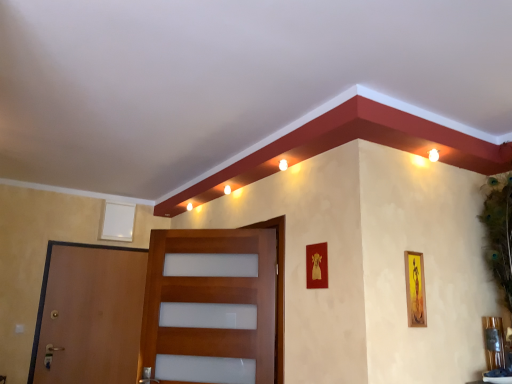
What do you see at coordinates (117, 222) in the screenshot?
I see `white matte picture frame at upper left, the first picture frame in the left-to-right sequence` at bounding box center [117, 222].

In order to click on yellow matte picture frame at right, which is the 1th picture frame from front to back in this screenshot , I will do `click(415, 289)`.

Find the location of `white matte picture frame at upper left, the first picture frame positioned from the back`. white matte picture frame at upper left, the first picture frame positioned from the back is located at coordinates [117, 222].

Consider the image. Could you tell me if white matte picture frame at upper left, the first picture frame in the left-to-right sequence, is turned towards wooden door at center, which is the first door in front-to-back order?

Yes, white matte picture frame at upper left, the first picture frame in the left-to-right sequence, is aimed at wooden door at center, which is the first door in front-to-back order.

Can you confirm if white matte picture frame at upper left, the first picture frame positioned from the back, is taller than wooden door at center, which is the first door in front-to-back order?

In fact, white matte picture frame at upper left, the first picture frame positioned from the back, may be shorter than wooden door at center, which is the first door in front-to-back order.

Is point (110, 229) positioned in front of point (273, 347)?

That is False.

From the image's perspective, is white matte picture frame at upper left, arranged as the third picture frame when viewed from the right, positioned above or below wooden door at center, which appears as the first door when viewed from the right?

white matte picture frame at upper left, arranged as the third picture frame when viewed from the right, is situated higher than wooden door at center, which appears as the first door when viewed from the right, in the image.

Which is further, (x=407, y=273) or (x=54, y=327)?

The point (x=54, y=327) is behind.

From a real-world perspective, who is located lower, yellow matte picture frame at right, the third picture frame when ordered from back to front, or brown wooden door at left, positioned as the second door in right-to-left order?

In real-world perspective, brown wooden door at left, positioned as the second door in right-to-left order, is lower.

Is yellow matte picture frame at right, placed as the third picture frame when sorted from left to right, at the left side of brown wooden door at left, which is counted as the first door, starting from the back?

Incorrect, yellow matte picture frame at right, placed as the third picture frame when sorted from left to right, is not on the left side of brown wooden door at left, which is counted as the first door, starting from the back.

Consider the image. From the image's perspective, which object appears higher, brown wooden door at left, which is counted as the first door, starting from the back, or yellow matte picture frame at right, which is the 1th picture frame from front to back?

yellow matte picture frame at right, which is the 1th picture frame from front to back.

Is brown wooden door at left, arranged as the first door when viewed from the left, wider or thinner than yellow matte picture frame at right, placed as the third picture frame when sorted from left to right?

In the image, brown wooden door at left, arranged as the first door when viewed from the left, appears to be wider than yellow matte picture frame at right, placed as the third picture frame when sorted from left to right.

From a real-world perspective, who is located higher, brown wooden door at left, which is the 2th door in front-to-back order, or yellow matte picture frame at right, which is counted as the first picture frame, starting from the right?

yellow matte picture frame at right, which is counted as the first picture frame, starting from the right.

Is point (72, 245) positioned in front of point (417, 324)?

No.

Can you see gold metallic picture frame at center, the second picture frame from the left, touching wooden door at center, which is the first door in front-to-back order?

No, gold metallic picture frame at center, the second picture frame from the left, is not making contact with wooden door at center, which is the first door in front-to-back order.

How distant is gold metallic picture frame at center, the second picture frame from the left, from wooden door at center, which is the first door in front-to-back order?

gold metallic picture frame at center, the second picture frame from the left, is 66.56 centimeters away from wooden door at center, which is the first door in front-to-back order.

How many degrees apart are the facing directions of gold metallic picture frame at center, which appears as the second picture frame when viewed from the right, and wooden door at center, which appears as the first door when viewed from the right?

64.3 degrees separate the facing orientations of gold metallic picture frame at center, which appears as the second picture frame when viewed from the right, and wooden door at center, which appears as the first door when viewed from the right.

Is gold metallic picture frame at center, the second picture frame in the back-to-front sequence, inside or outside of wooden door at center, positioned as the 2th door in left-to-right order?

gold metallic picture frame at center, the second picture frame in the back-to-front sequence, is not enclosed by wooden door at center, positioned as the 2th door in left-to-right order.

From the image's perspective, which is above, brown wooden door at left, arranged as the first door when viewed from the left, or white matte picture frame at upper left, the first picture frame positioned from the back?

white matte picture frame at upper left, the first picture frame positioned from the back, from the image's perspective.

Is brown wooden door at left, which is the 2th door in front-to-back order, not close to white matte picture frame at upper left, the first picture frame positioned from the back?

No, brown wooden door at left, which is the 2th door in front-to-back order, is not far from white matte picture frame at upper left, the first picture frame positioned from the back.

What's the angular difference between brown wooden door at left, arranged as the first door when viewed from the left, and white matte picture frame at upper left, the first picture frame in the left-to-right sequence,'s facing directions?

The facing directions of brown wooden door at left, arranged as the first door when viewed from the left, and white matte picture frame at upper left, the first picture frame in the left-to-right sequence, are 0.312 degrees apart.

Locate an element on the screen. This screenshot has width=512, height=384. the 1st door in front when counting from the white matte picture frame at upper left, the first picture frame in the left-to-right sequence is located at coordinates (90, 314).

At what (x,y) coordinates should I click in order to perform the action: click on the 2nd picture frame below the white matte picture frame at upper left, arranged as the third picture frame when viewed from the front (from the image's perspective). Please return your answer as a coordinate pair (x, y). Image resolution: width=512 pixels, height=384 pixels. Looking at the image, I should click on (415, 289).

Would you consider yellow matte picture frame at right, which is the 1th picture frame from front to back, to be distant from white matte picture frame at upper left, arranged as the third picture frame when viewed from the right?

Indeed, yellow matte picture frame at right, which is the 1th picture frame from front to back, is not near white matte picture frame at upper left, arranged as the third picture frame when viewed from the right.

Considering the sizes of objects yellow matte picture frame at right, the third picture frame when ordered from back to front, and white matte picture frame at upper left, the first picture frame in the left-to-right sequence, in the image provided, who is taller, yellow matte picture frame at right, the third picture frame when ordered from back to front, or white matte picture frame at upper left, the first picture frame in the left-to-right sequence,?

Standing taller between the two is yellow matte picture frame at right, the third picture frame when ordered from back to front.

From the image's perspective, is yellow matte picture frame at right, the third picture frame when ordered from back to front, located above or below white matte picture frame at upper left, the first picture frame in the left-to-right sequence?

Clearly, from the image's perspective, yellow matte picture frame at right, the third picture frame when ordered from back to front, is below white matte picture frame at upper left, the first picture frame in the left-to-right sequence.

From the image's perspective, which object appears higher, wooden door at center, positioned as the 2th door in left-to-right order, or gold metallic picture frame at center, the second picture frame from the left?

gold metallic picture frame at center, the second picture frame from the left, appears higher in the image.

In the scene shown: What's the angular difference between wooden door at center, which appears as the first door when viewed from the right, and gold metallic picture frame at center, the second picture frame in the back-to-front sequence,'s facing directions?

There is a 64.3-degree angle between the facing directions of wooden door at center, which appears as the first door when viewed from the right, and gold metallic picture frame at center, the second picture frame in the back-to-front sequence.

Can you confirm if wooden door at center, which is the first door in front-to-back order, is smaller than gold metallic picture frame at center, which appears as the second picture frame when viewed from the right?

No.

In order to click on the 1st door below the white matte picture frame at upper left, arranged as the third picture frame when viewed from the right (from the image's perspective) in this screenshot , I will do `click(211, 299)`.

Where is `the 3rd picture frame counting from the right of the brown wooden door at left, positioned as the second door in right-to-left order`? the 3rd picture frame counting from the right of the brown wooden door at left, positioned as the second door in right-to-left order is located at coordinates (415, 289).

From the image, which object appears to be nearer to brown wooden door at left, positioned as the second door in right-to-left order, yellow matte picture frame at right, which is the 1th picture frame from front to back, or gold metallic picture frame at center, the second picture frame in the back-to-front sequence?

Among the two, gold metallic picture frame at center, the second picture frame in the back-to-front sequence, is located nearer to brown wooden door at left, positioned as the second door in right-to-left order.

Based on the photo, looking at the image, which one is located closer to gold metallic picture frame at center, marked as the second picture frame in a front-to-back arrangement, wooden door at center, which appears as the first door when viewed from the right, or brown wooden door at left, which is the 2th door in front-to-back order?

Based on the image, wooden door at center, which appears as the first door when viewed from the right, appears to be nearer to gold metallic picture frame at center, marked as the second picture frame in a front-to-back arrangement.

Looking at the image, which one is located closer to gold metallic picture frame at center, which appears as the second picture frame when viewed from the right, wooden door at center, positioned as the 2th door in left-to-right order, or yellow matte picture frame at right, placed as the third picture frame when sorted from left to right?

yellow matte picture frame at right, placed as the third picture frame when sorted from left to right, is positioned closer to the anchor gold metallic picture frame at center, which appears as the second picture frame when viewed from the right.

Which object lies nearer to the anchor point yellow matte picture frame at right, the third picture frame when ordered from back to front, gold metallic picture frame at center, the second picture frame in the back-to-front sequence, or wooden door at center, which is the first door in front-to-back order?

Based on the image, gold metallic picture frame at center, the second picture frame in the back-to-front sequence, appears to be nearer to yellow matte picture frame at right, the third picture frame when ordered from back to front.

From the image, which object appears to be nearer to brown wooden door at left, which is the 2th door in front-to-back order, gold metallic picture frame at center, the second picture frame in the back-to-front sequence, or wooden door at center, placed as the 2th door when sorted from back to front?

wooden door at center, placed as the 2th door when sorted from back to front, is positioned closer to the anchor brown wooden door at left, which is the 2th door in front-to-back order.

Looking at the image, which one is located closer to yellow matte picture frame at right, placed as the third picture frame when sorted from left to right, gold metallic picture frame at center, the second picture frame in the back-to-front sequence, or white matte picture frame at upper left, arranged as the third picture frame when viewed from the front?

The object closer to yellow matte picture frame at right, placed as the third picture frame when sorted from left to right, is gold metallic picture frame at center, the second picture frame in the back-to-front sequence.

Which object lies nearer to the anchor point white matte picture frame at upper left, arranged as the third picture frame when viewed from the front, brown wooden door at left, positioned as the second door in right-to-left order, or gold metallic picture frame at center, the second picture frame in the back-to-front sequence?

brown wooden door at left, positioned as the second door in right-to-left order, is positioned closer to the anchor white matte picture frame at upper left, arranged as the third picture frame when viewed from the front.

Which object lies nearer to the anchor point gold metallic picture frame at center, which appears as the second picture frame when viewed from the right, wooden door at center, which appears as the first door when viewed from the right, or white matte picture frame at upper left, the first picture frame in the left-to-right sequence?

wooden door at center, which appears as the first door when viewed from the right.

Identify the location of picture frame between wooden door at center, which is the first door in front-to-back order, and yellow matte picture frame at right, which is counted as the first picture frame, starting from the right. (317, 266).

Image resolution: width=512 pixels, height=384 pixels. I want to click on picture frame situated between white matte picture frame at upper left, arranged as the third picture frame when viewed from the front, and yellow matte picture frame at right, which is counted as the first picture frame, starting from the right, from left to right, so click(317, 266).

I want to click on picture frame between brown wooden door at left, which is counted as the first door, starting from the back, and gold metallic picture frame at center, the second picture frame in the back-to-front sequence, from left to right, so 117,222.

What are the coordinates of `door between white matte picture frame at upper left, the first picture frame in the left-to-right sequence, and yellow matte picture frame at right, the third picture frame when ordered from back to front` in the screenshot? It's located at (211, 299).